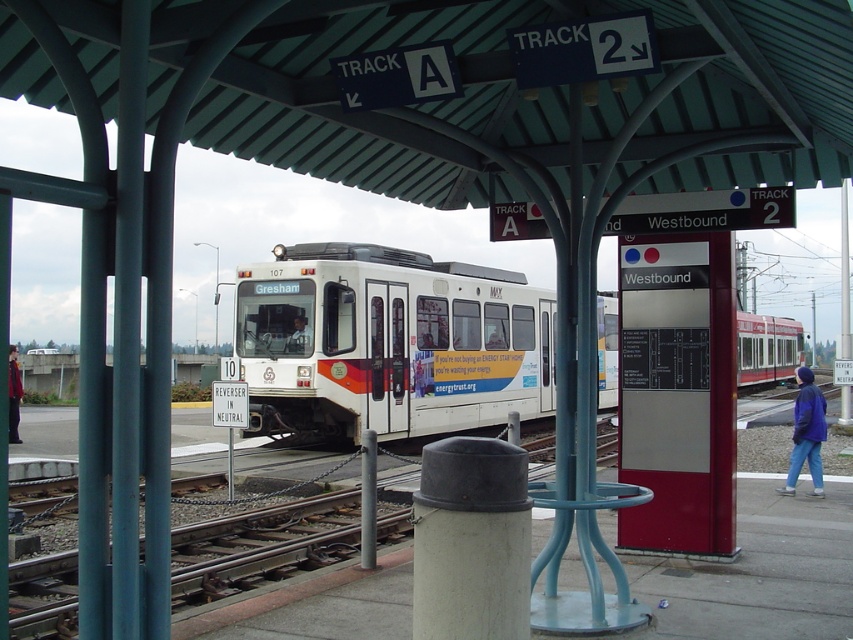
Question: Which object is closer to the camera taking this photo?

Choices:
 (A) red jacket at lower left
 (B) matte black train at center
 (C) white matte trash can at center
 (D) white glossy train at center

Answer: (A)

Question: Is blue denim jacket at lower right thinner than red jacket at lower left?

Choices:
 (A) no
 (B) yes

Answer: (B)

Question: Which point is farther to the camera?

Choices:
 (A) (299, 339)
 (B) (9, 426)
 (C) (387, 358)

Answer: (C)

Question: In this image, where is white glossy train at center located relative to white matte trash can at center?

Choices:
 (A) right
 (B) left

Answer: (A)

Question: Can you confirm if white glossy train at center is smaller than matte black train at center?

Choices:
 (A) no
 (B) yes

Answer: (A)

Question: Estimate the real-world distances between objects in this image. Which object is closer to the white matte trash can at center?

Choices:
 (A) matte black train at center
 (B) white glossy train at center
 (C) red jacket at lower left

Answer: (C)